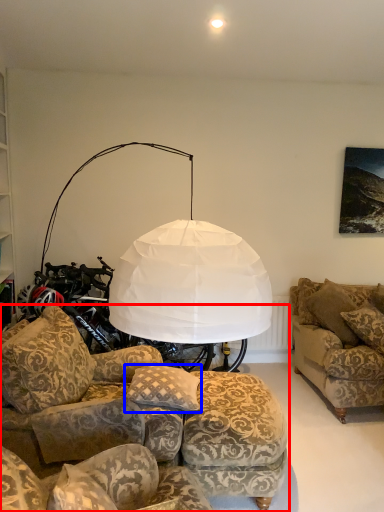
Question: Which point is further to the camera, studio couch (highlighted by a red box) or pillow (highlighted by a blue box)?

Choices:
 (A) studio couch
 (B) pillow

Answer: (B)